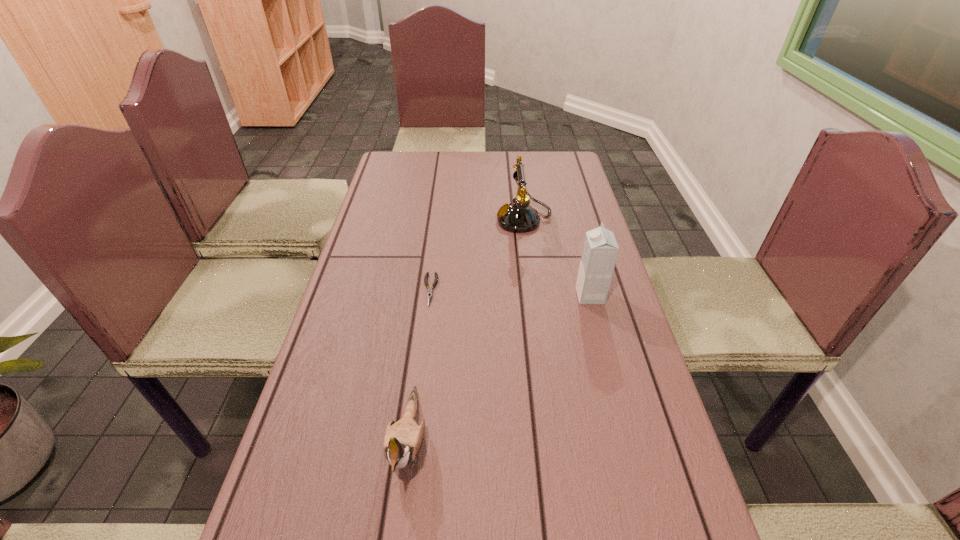
Image resolution: width=960 pixels, height=540 pixels. Identify the location of the rightmost object. (600, 250).

Where is `carton`? The width and height of the screenshot is (960, 540). carton is located at coordinates (600, 250).

Locate an element on the screen. The height and width of the screenshot is (540, 960). the farthest object is located at coordinates (519, 217).

Image resolution: width=960 pixels, height=540 pixels. I want to click on the second object from right to left, so click(x=519, y=217).

The width and height of the screenshot is (960, 540). Find the location of `bird`. bird is located at coordinates tap(403, 440).

I want to click on pliers, so click(x=429, y=292).

I want to click on vacant space situated on the front label of the tallest object, so click(x=459, y=295).

The image size is (960, 540). Find the location of `vacant space located 0.280m on the front label of the tallest object`. vacant space located 0.280m on the front label of the tallest object is located at coordinates (470, 295).

Locate an element on the screen. The height and width of the screenshot is (540, 960). vacant area located on the front label of the tallest object is located at coordinates (490, 295).

The width and height of the screenshot is (960, 540). In order to click on free region located on the dial of the telephone in this screenshot , I will do (416, 219).